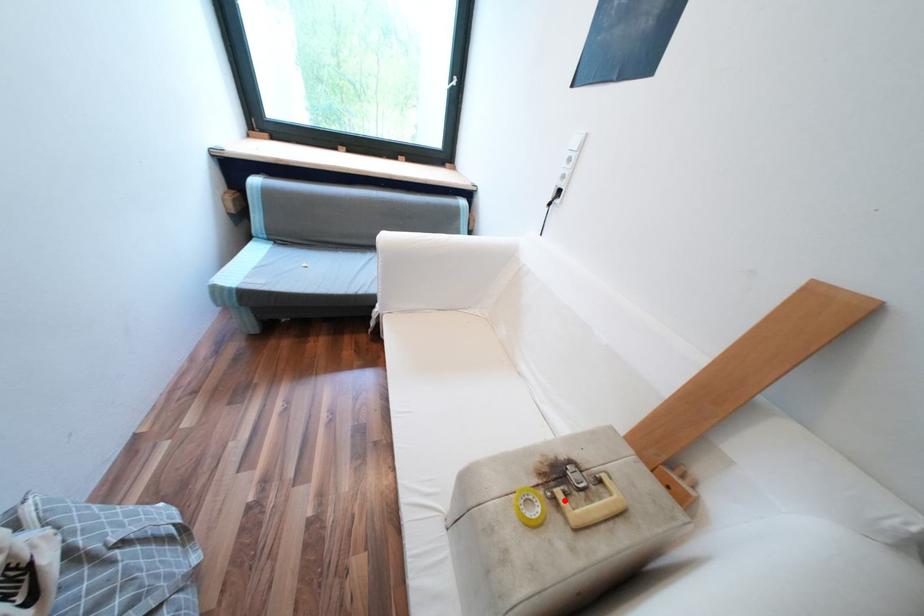
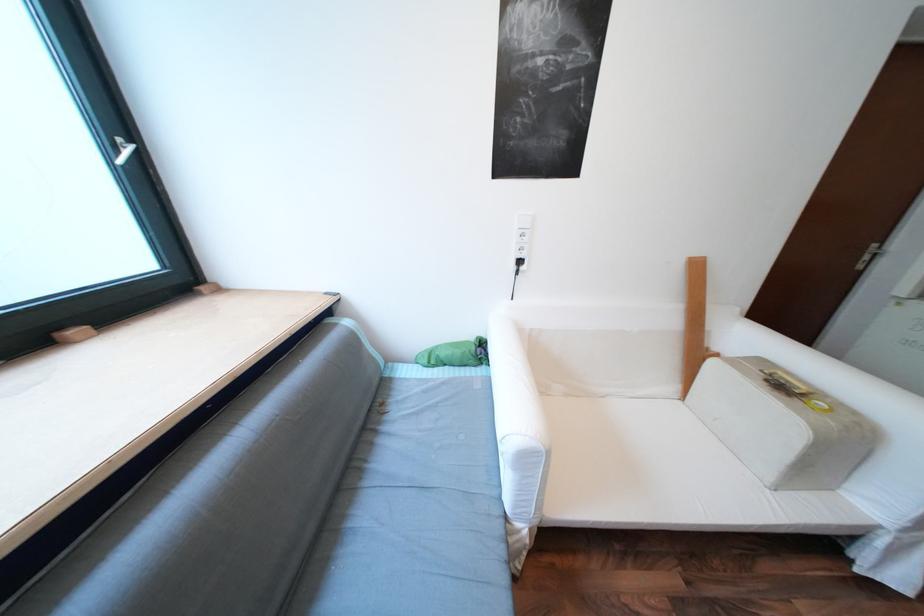
Find the pixel in the second image that matches the highlighted location in the first image.

(811, 394)